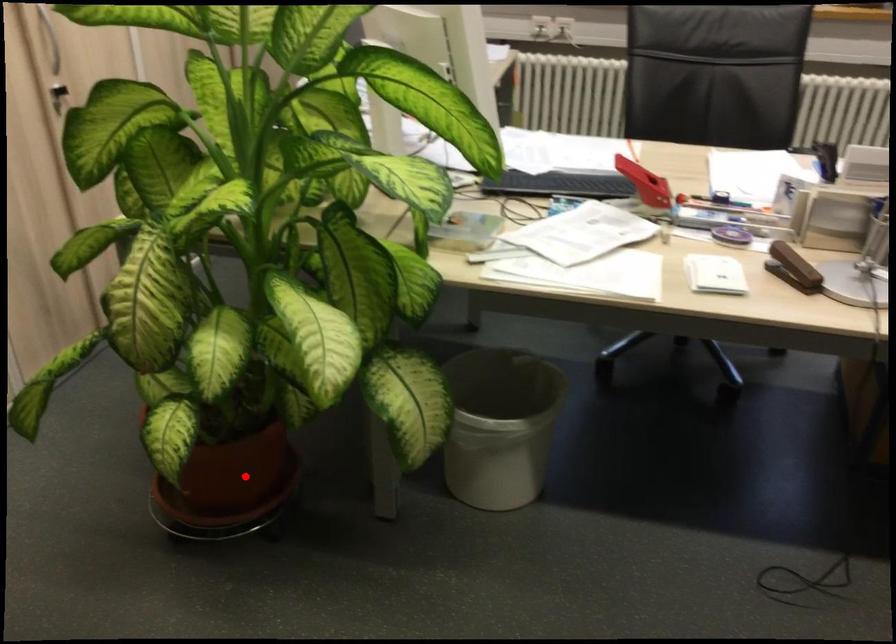
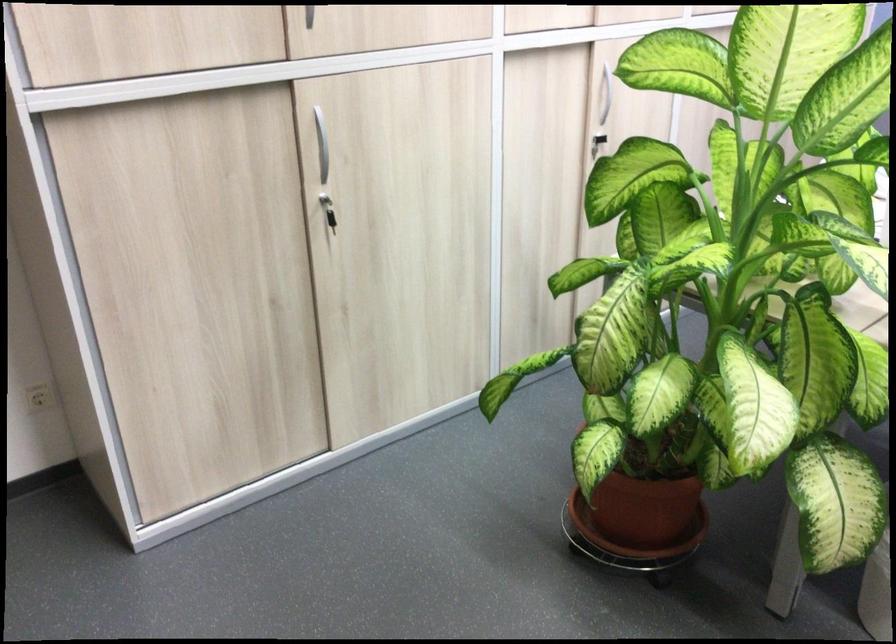
Find the pixel in the second image that matches the highlighted location in the first image.

(643, 509)